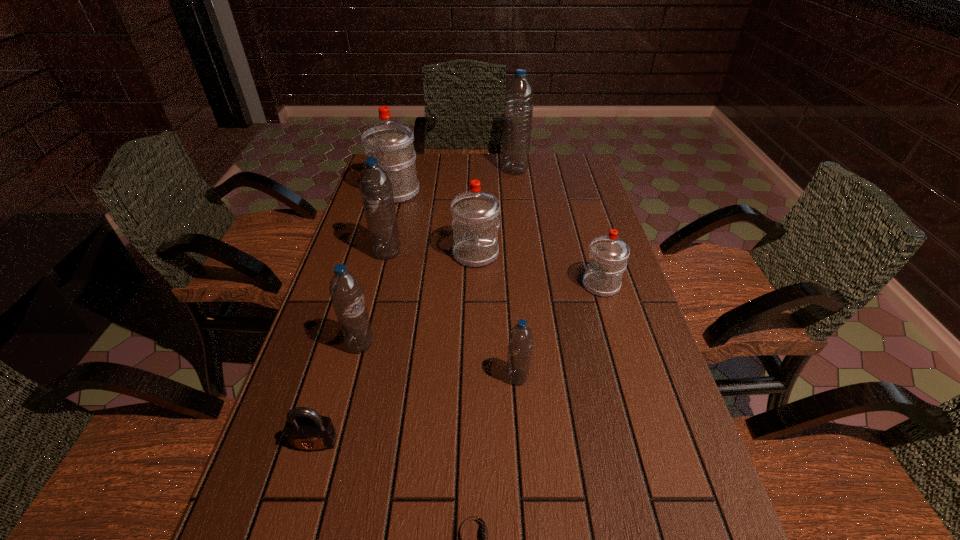
What are the coordinates of `free space located 0.320m on the handle side of the rightmost white water bottle` in the screenshot? It's located at (465, 285).

At what (x,y) coordinates should I click in order to perform the action: click on vacant space situated 0.130m on the handle side of the rightmost white water bottle. Please return your answer as a coordinate pair (x, y). Image resolution: width=960 pixels, height=540 pixels. Looking at the image, I should click on (535, 285).

You are a GUI agent. You are given a task and a screenshot of the screen. Output one action in this format:
    pyautogui.click(x=<x>, y=<y>)
    Task: Click on the vacant region located 0.280m on the handle side of the rightmost white water bottle
    The width and height of the screenshot is (960, 540).
    Given the screenshot: What is the action you would take?
    pyautogui.click(x=479, y=285)

Where is `vacant space located on the front of the eighth farthest object near the keyhole`? The height and width of the screenshot is (540, 960). vacant space located on the front of the eighth farthest object near the keyhole is located at coordinates (304, 479).

You are a GUI agent. You are given a task and a screenshot of the screen. Output one action in this format:
    pyautogui.click(x=<x>, y=<y>)
    Task: Click on the padlock present at the left edge
    
    Given the screenshot: What is the action you would take?
    pyautogui.click(x=305, y=429)

The height and width of the screenshot is (540, 960). I want to click on object at the right edge, so click(608, 254).

Where is `object located at the far left corner`? This screenshot has height=540, width=960. object located at the far left corner is located at coordinates [x=392, y=142].

At what (x,y) coordinates should I click in order to perform the action: click on vacant space at the far edge of the desktop. Please return your answer as a coordinate pair (x, y). Image resolution: width=960 pixels, height=540 pixels. Looking at the image, I should click on (515, 179).

The width and height of the screenshot is (960, 540). I want to click on free space at the left edge of the desktop, so click(286, 488).

Locate an element on the screen. The image size is (960, 540). vacant space at the right edge is located at coordinates (597, 360).